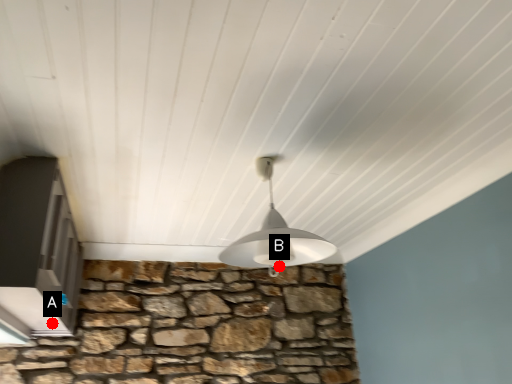
Question: Two points are circled on the image, labeled by A and B beside each circle. Which point is closer to the camera?

Choices:
 (A) A is closer
 (B) B is closer

Answer: (A)